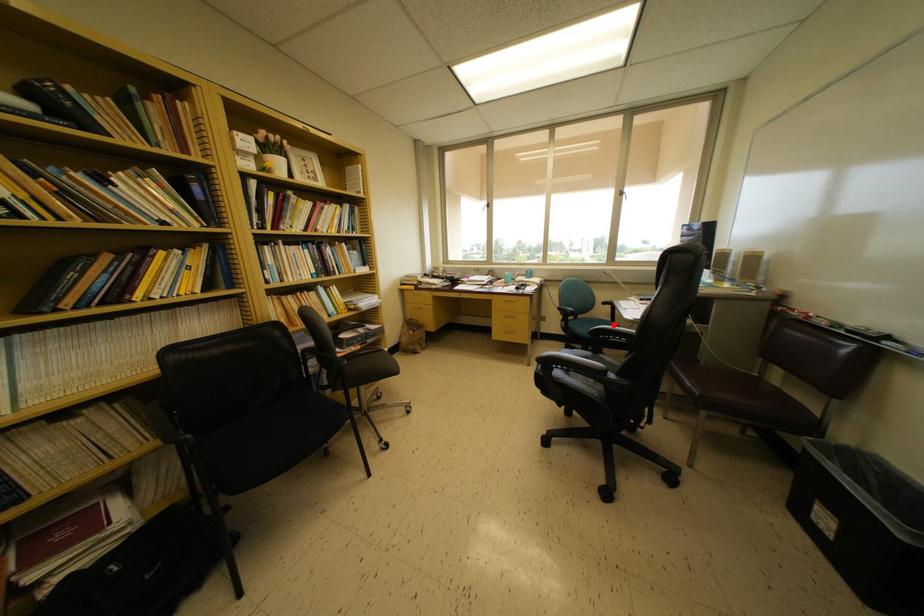
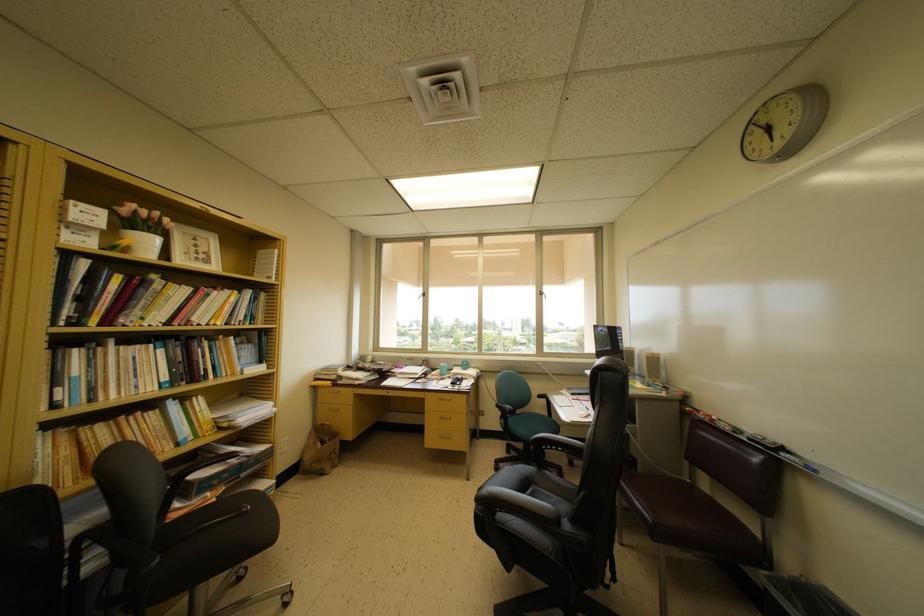
Question: I am providing you with two images of the same scene from different viewpoints. A red point is marked on the first image. At the location where the point appears in image 1, is it still visible in image 2?

Choices:
 (A) Yes
 (B) No

Answer: (A)